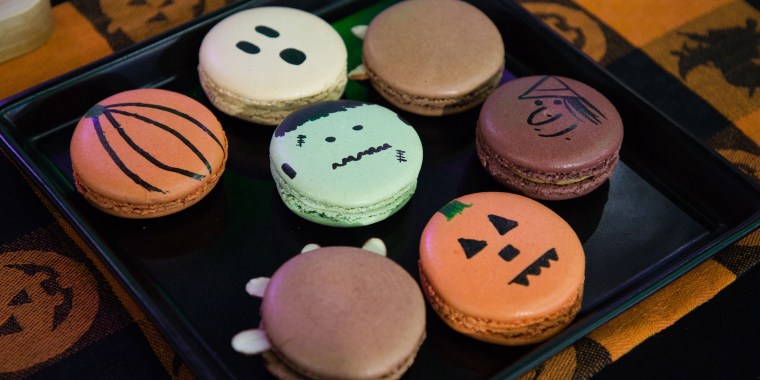
The height and width of the screenshot is (380, 760). What are the coordinates of `tablecloth` in the screenshot? It's located at (695, 73), (701, 340), (84, 39).